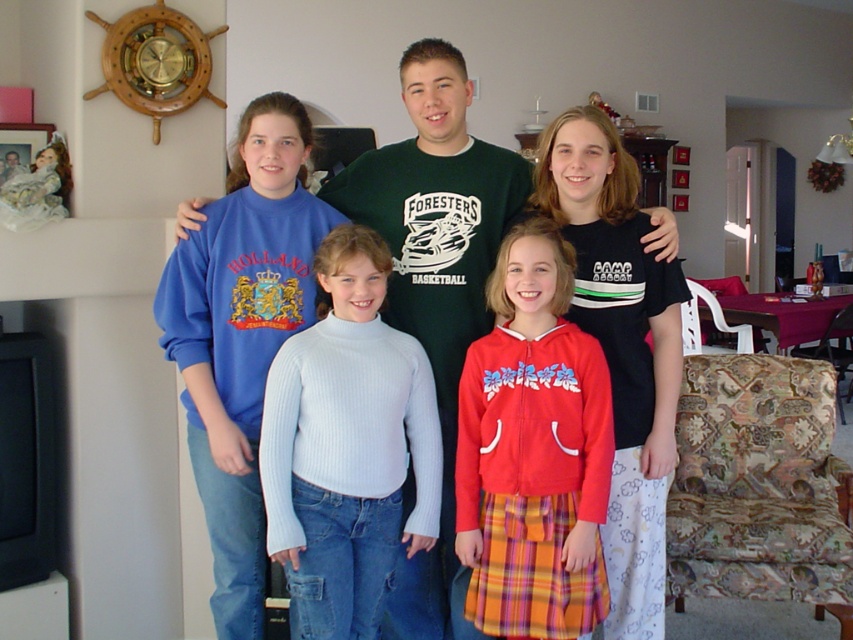
You are a photographer trying to capture a clear shot of both the white ribbed sweater at center and the red fleece jacket at center. Since you want to ensure both are fully visible in your frame, which object should you focus on first to account for their sizes?

The white ribbed sweater at center is much taller than the red fleece jacket at center, so you should focus on the white ribbed sweater at center first to ensure its full height is captured in the frame.

You are a photographer trying to capture a clear shot of both the white ribbed sweater at center and the red fleece jacket at center. Based on their positions, which one might be partially obscured in the photo?

The red fleece jacket at center is behind the white ribbed sweater at center, so it might be partially obscured in the photo.

You are a photographer trying to capture a clear shot of both the white ribbed sweater at center and the matte blue sweatshirt at upper left. Based on their sizes in the image, which one might require you to zoom in more to include its full view?

The white ribbed sweater at center is much taller than the matte blue sweatshirt at upper left, so you would need to zoom in more to capture the taller white ribbed sweater at center in its entirety.